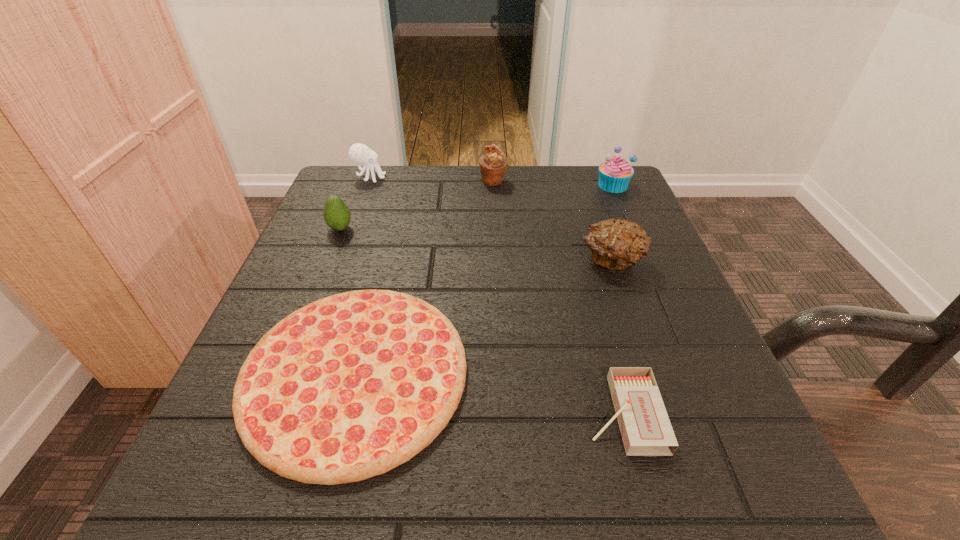
Identify the location of the fourth object from right to left. This screenshot has height=540, width=960. (493, 164).

Image resolution: width=960 pixels, height=540 pixels. Find the location of `octopus`. octopus is located at coordinates (359, 153).

At what (x,y) coordinates should I click in order to perform the action: click on the fourth nearest object. Please return your answer as a coordinate pair (x, y). Image resolution: width=960 pixels, height=540 pixels. Looking at the image, I should click on (337, 216).

At what (x,y) coordinates should I click in order to perform the action: click on the nearest muffin. Please return your answer as a coordinate pair (x, y). The image size is (960, 540). Looking at the image, I should click on (615, 244).

Find the location of `the sixth tallest object`. the sixth tallest object is located at coordinates point(644,424).

The width and height of the screenshot is (960, 540). What are the coordinates of `pizza` in the screenshot? It's located at (348, 387).

This screenshot has width=960, height=540. I want to click on free space located on the right of the leftmost muffin, so click(x=623, y=181).

The height and width of the screenshot is (540, 960). Identify the location of free location located 0.290m on the front-facing side of the octopus. (504, 177).

Where is `vacant space located on the front of the fourth farthest object`? vacant space located on the front of the fourth farthest object is located at coordinates (282, 374).

Where is `blank area located on the left of the fifth farthest object`? blank area located on the left of the fifth farthest object is located at coordinates (413, 261).